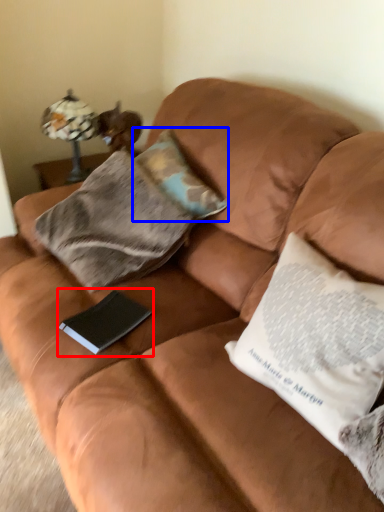
Question: Which of the following is the farthest to the observer, paperback book (highlighted by a red box) or pillow (highlighted by a blue box)?

Choices:
 (A) paperback book
 (B) pillow

Answer: (B)